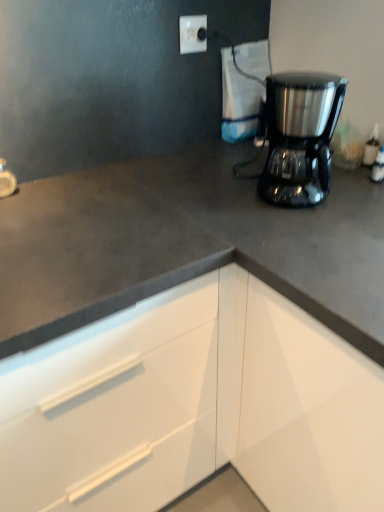
Locate an element on the screen. This screenshot has height=512, width=384. empty space that is to the right of satin black coffee maker at upper right is located at coordinates tap(344, 189).